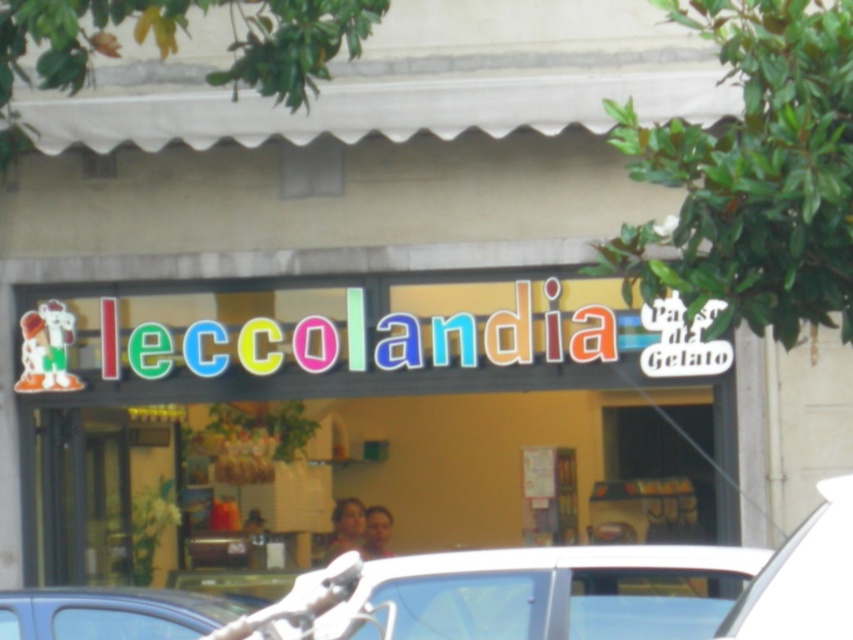
Does white glossy car at lower center have a smaller size compared to white matte car at lower right?

Incorrect, white glossy car at lower center is not smaller in size than white matte car at lower right.

Is point (519, 604) behind point (840, 548)?

Yes, it is.

Between point (438, 573) and point (828, 541), which one is positioned in front?

Point (828, 541)

Find the location of a particular element. Image resolution: width=853 pixels, height=640 pixels. white glossy car at lower center is located at coordinates click(544, 593).